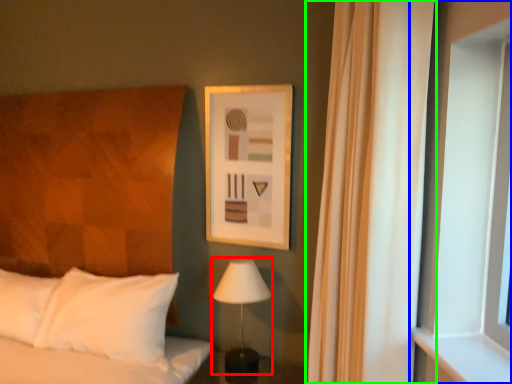
Question: Estimate the real-world distances between objects in this image. Which object is farther from table lamp (highlighted by a red box), window (highlighted by a blue box) or curtain (highlighted by a green box)?

Choices:
 (A) window
 (B) curtain

Answer: (A)